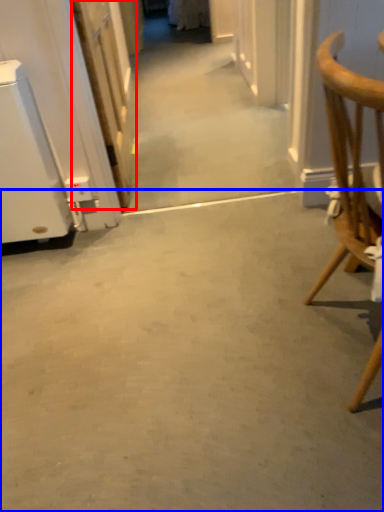
Question: Which object is closer to the camera taking this photo, door (highlighted by a red box) or concrete (highlighted by a blue box)?

Choices:
 (A) door
 (B) concrete

Answer: (B)